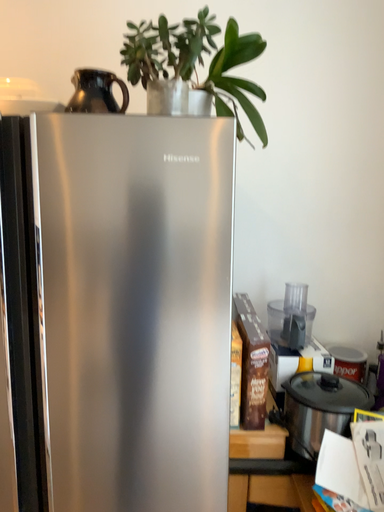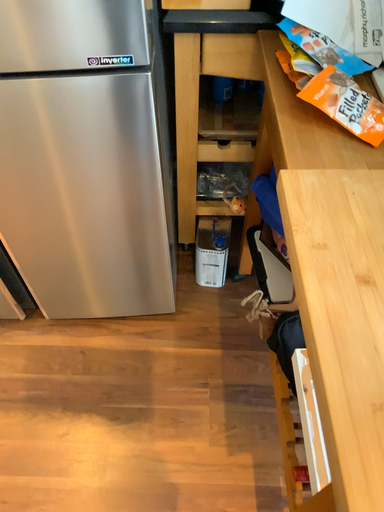
Question: Which way did the camera rotate in the video?

Choices:
 (A) rotated upward
 (B) rotated downward

Answer: (B)